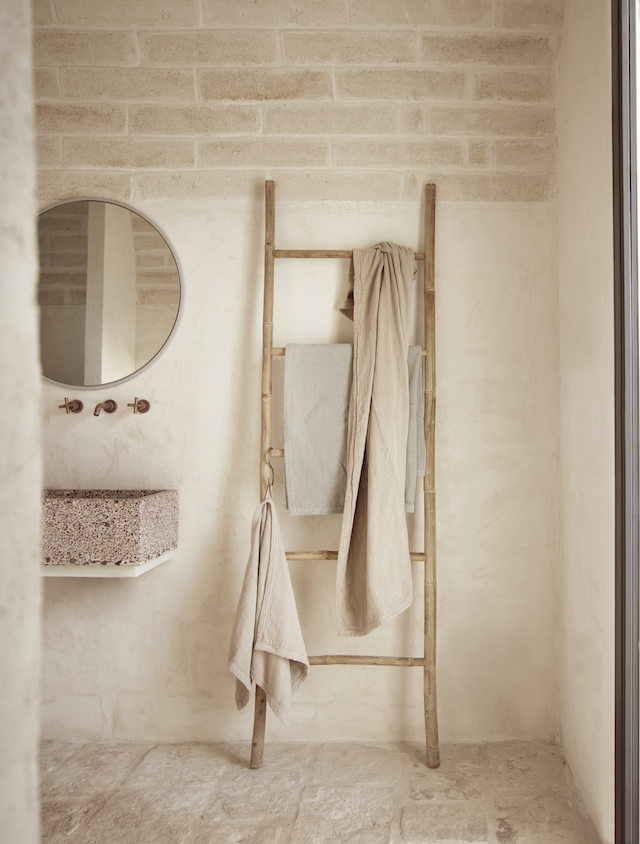
This screenshot has height=844, width=640. Find the location of `brick wall`. brick wall is located at coordinates click(276, 79).